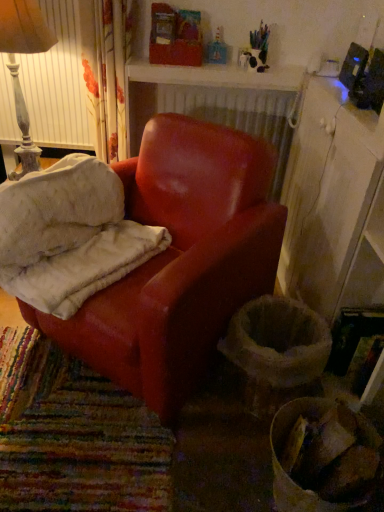
Question: Relative to white textured radiator at upper center, is leather armchair at center in front or behind?

Choices:
 (A) behind
 (B) front

Answer: (B)

Question: In the image, is leather armchair at center on the left side or the right side of white textured radiator at upper center?

Choices:
 (A) right
 (B) left

Answer: (B)

Question: Which of these objects is positioned farthest from the white wood cabinet at right?

Choices:
 (A) distressed white lampshade at upper left
 (B) leather armchair at center
 (C) white textured radiator at upper center
 (D) matte red armchair at center

Answer: (A)

Question: Estimate the real-world distances between objects in this image. Which object is closer to the leather armchair at center?

Choices:
 (A) white wood cabinet at right
 (B) distressed white lampshade at upper left
 (C) matte red armchair at center
 (D) white textured radiator at upper center

Answer: (C)